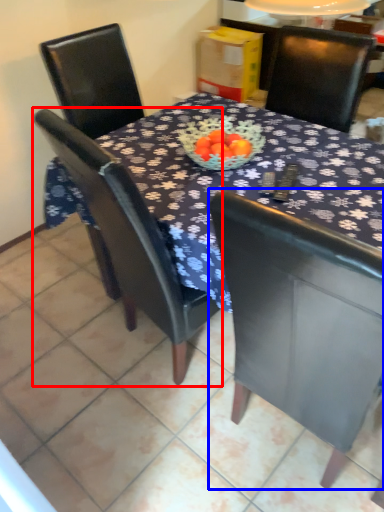
Question: Which point is further to the camera, chair (highlighted by a red box) or chair (highlighted by a blue box)?

Choices:
 (A) chair
 (B) chair

Answer: (A)